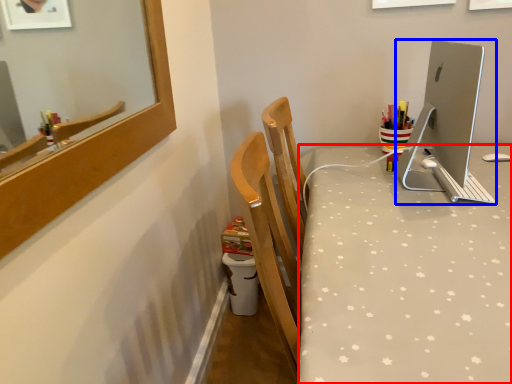
Question: Which of the following is the closest to the observer, desk (highlighted by a red box) or desktop computer (highlighted by a blue box)?

Choices:
 (A) desk
 (B) desktop computer

Answer: (A)